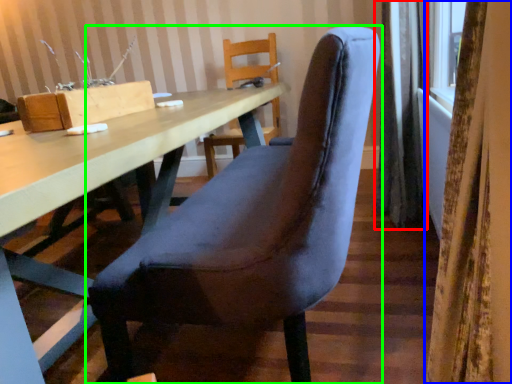
Question: Estimate the real-world distances between objects in this image. Which object is closer to curtain (highlighted by a red box), curtain (highlighted by a blue box) or chair (highlighted by a green box)?

Choices:
 (A) curtain
 (B) chair

Answer: (B)